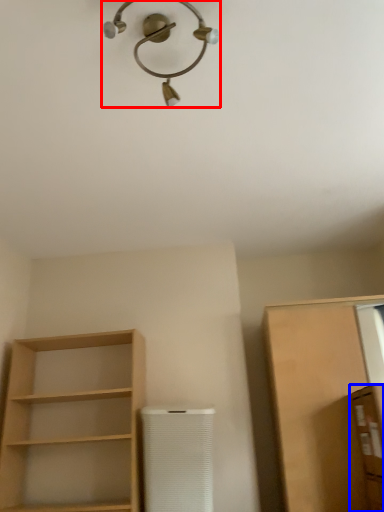
Question: Which point is further to the camera, light fixture (highlighted by a red box) or cabinetry (highlighted by a blue box)?

Choices:
 (A) light fixture
 (B) cabinetry

Answer: (B)